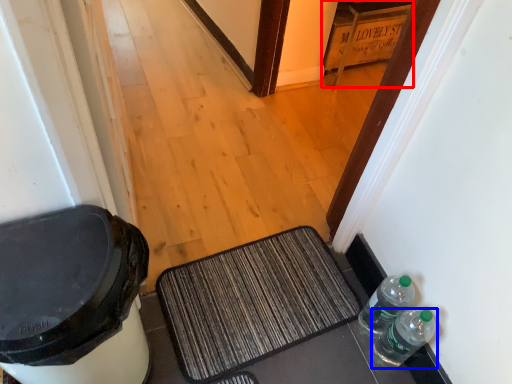
Question: Which of the following is the closest to the observer, cabinetry (highlighted by a red box) or bottle (highlighted by a blue box)?

Choices:
 (A) cabinetry
 (B) bottle

Answer: (B)